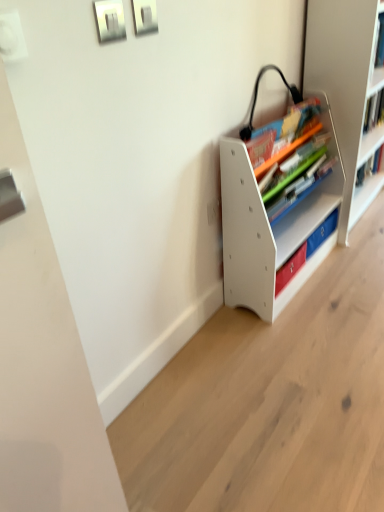
Question: Considering the relative sizes of white matte bookshelf at center, the 2th shelf from the right, and matte plastic books at center in the image provided, is white matte bookshelf at center, the 2th shelf from the right, bigger than matte plastic books at center?

Choices:
 (A) no
 (B) yes

Answer: (B)

Question: Is white matte bookshelf at center, the 2th shelf from the right, wider than matte plastic books at center?

Choices:
 (A) yes
 (B) no

Answer: (A)

Question: From a real-world perspective, is white matte bookshelf at center, which is the first shelf from left to right, located higher than matte plastic books at center?

Choices:
 (A) no
 (B) yes

Answer: (A)

Question: From a real-world perspective, is white matte bookshelf at center, which is the first shelf from left to right, physically below matte plastic books at center?

Choices:
 (A) yes
 (B) no

Answer: (A)

Question: Is white matte bookshelf at center, the 2th shelf from the right, at the right side of matte plastic books at center?

Choices:
 (A) no
 (B) yes

Answer: (B)

Question: Would you say white matte bookshelf at center, which is the first shelf from left to right, contains matte plastic books at center?

Choices:
 (A) no
 (B) yes

Answer: (B)

Question: From the image's perspective, is white plastic bookshelf at right, which is counted as the 2th shelf, starting from the left, located beneath white matte bookshelf at center, which is the first shelf from left to right?

Choices:
 (A) yes
 (B) no

Answer: (B)

Question: Is white plastic bookshelf at right, the first shelf positioned from the right, next to white matte bookshelf at center, which is the first shelf from left to right?

Choices:
 (A) yes
 (B) no

Answer: (B)

Question: Is white plastic bookshelf at right, the first shelf positioned from the right, far away from white matte bookshelf at center, which is the first shelf from left to right?

Choices:
 (A) no
 (B) yes

Answer: (A)

Question: Can you confirm if white plastic bookshelf at right, which is counted as the 2th shelf, starting from the left, is shorter than white matte bookshelf at center, the 2th shelf from the right?

Choices:
 (A) no
 (B) yes

Answer: (A)

Question: Is white plastic bookshelf at right, the first shelf positioned from the right, looking in the opposite direction of white matte bookshelf at center, the 2th shelf from the right?

Choices:
 (A) yes
 (B) no

Answer: (B)

Question: Does white plastic bookshelf at right, the first shelf positioned from the right, appear on the right side of white matte bookshelf at center, the 2th shelf from the right?

Choices:
 (A) yes
 (B) no

Answer: (A)

Question: Is white matte bookshelf at center, the 2th shelf from the right, oriented towards white plastic bookshelf at right, which is counted as the 2th shelf, starting from the left?

Choices:
 (A) yes
 (B) no

Answer: (B)